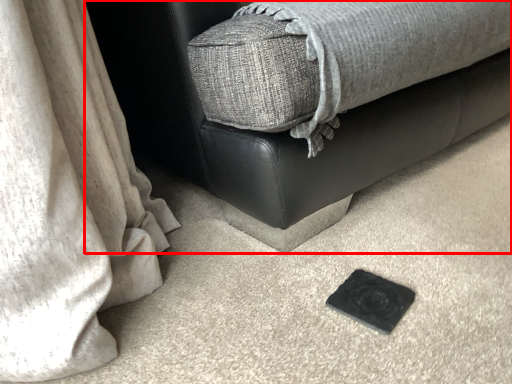
Question: From the image's perspective, what is the correct spatial positioning of furniture (annotated by the red box) in reference to pad?

Choices:
 (A) below
 (B) above

Answer: (B)